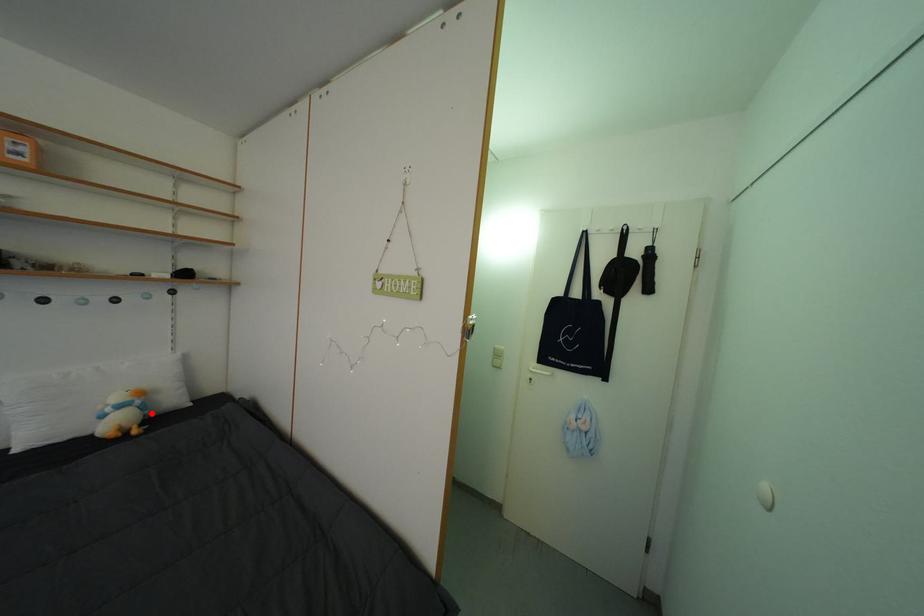
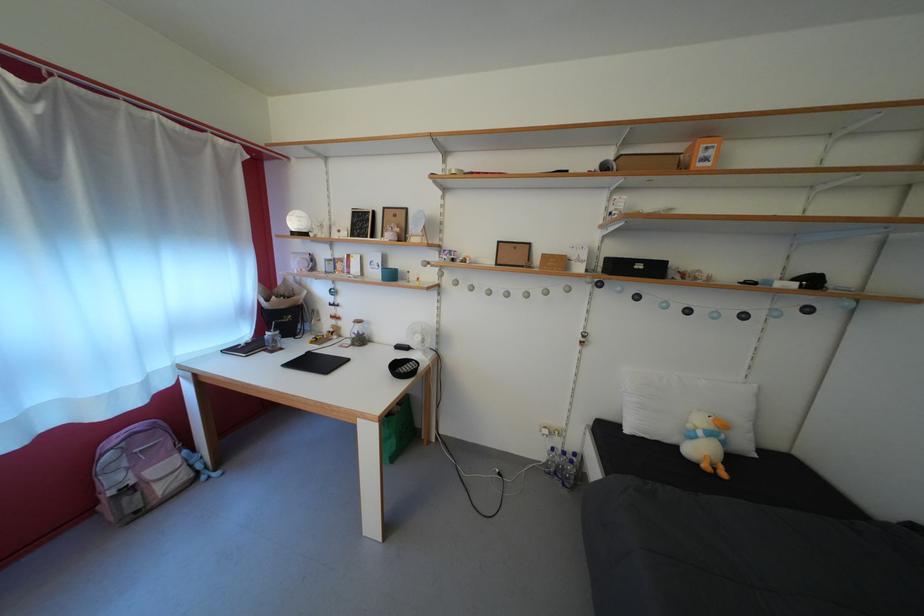
The point at the highlighted location is marked in the first image. Where is the corresponding point in the second image?

(732, 448)